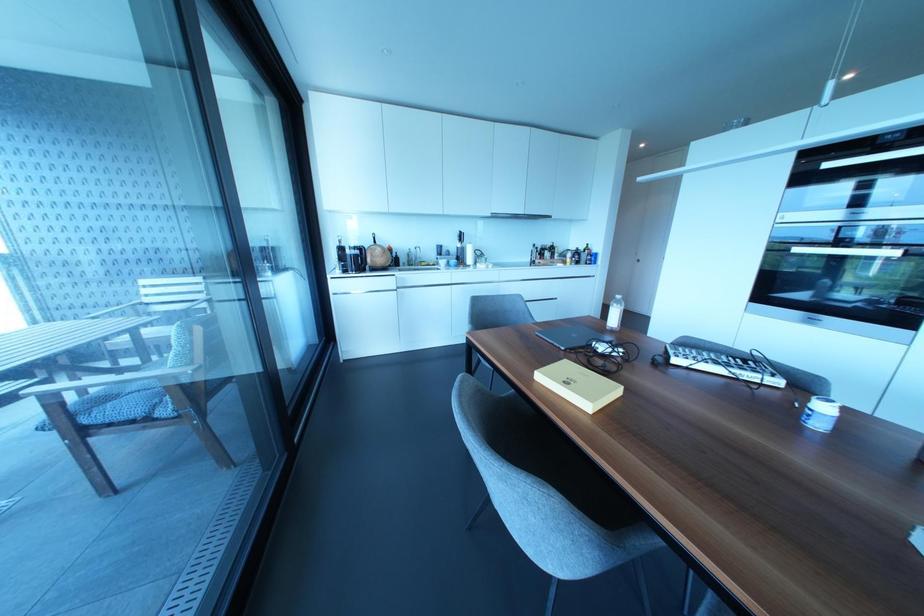
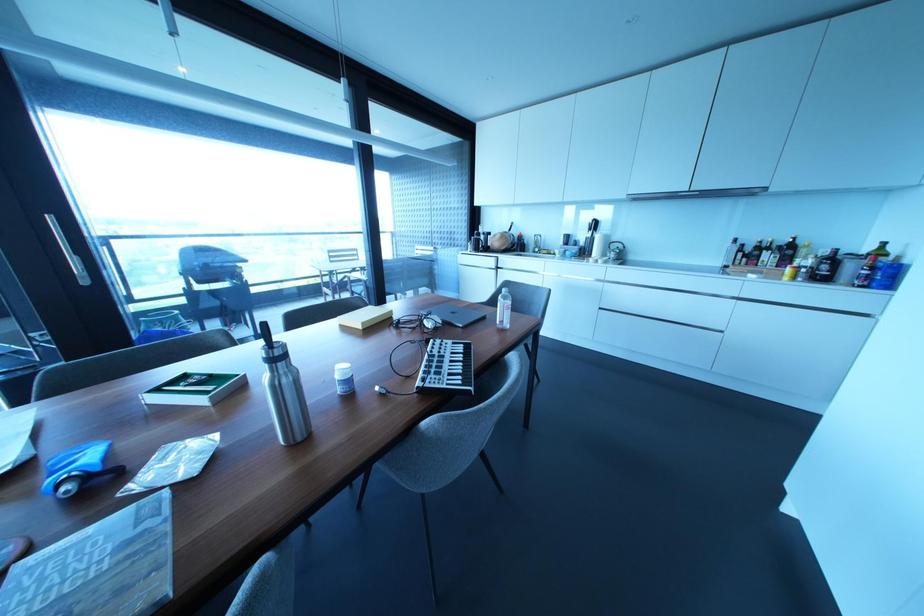
In the second image, find the point that corresponds to point (576, 252) in the first image.

(833, 257)